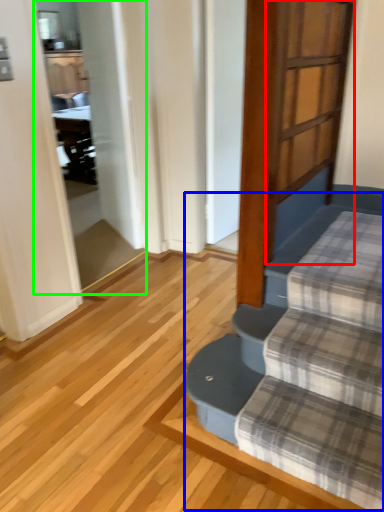
Question: Estimate the real-world distances between objects in this image. Which object is closer to screen door (highlighted by a red box), stairwell (highlighted by a blue box) or screen door (highlighted by a green box)?

Choices:
 (A) stairwell
 (B) screen door

Answer: (A)